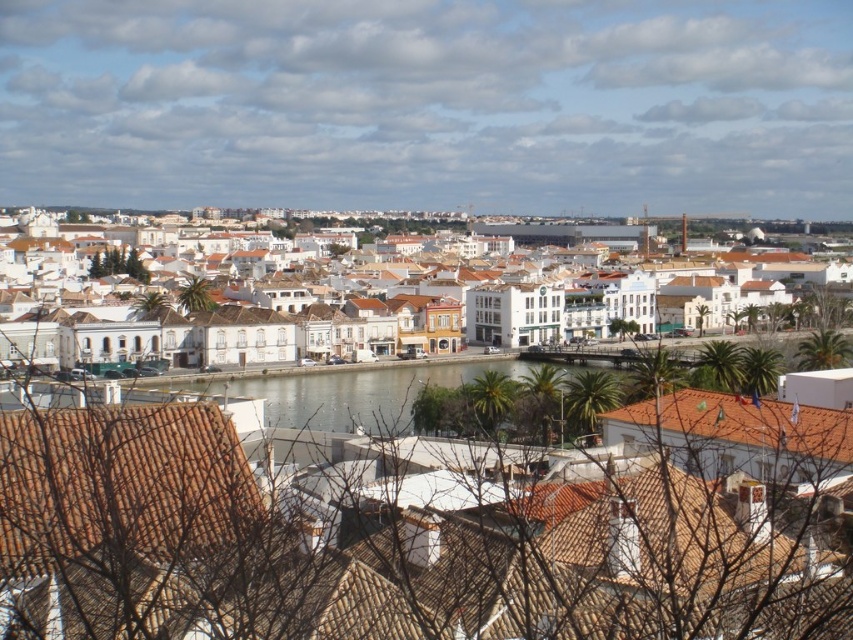
Question: From the image, what is the correct spatial relationship of brown tile roof at lower left in relation to brown tile roof at lower right?

Choices:
 (A) left
 (B) right

Answer: (A)

Question: Considering the real-world distances, which object is closest to the white stucco buildings at center?

Choices:
 (A) brown tile roof at lower right
 (B) brown tile roof at lower left

Answer: (B)

Question: Which of the following is the closest to the observer?

Choices:
 (A) (199, 515)
 (B) (263, 330)
 (C) (720, 440)

Answer: (A)

Question: Which object appears farthest from the camera in this image?

Choices:
 (A) brown tile roof at lower right
 (B) brown tile roof at lower left
 (C) white stucco buildings at center

Answer: (C)

Question: Does white stucco buildings at center come behind brown tile roof at lower right?

Choices:
 (A) no
 (B) yes

Answer: (B)

Question: Is white stucco buildings at center smaller than brown tile roof at lower right?

Choices:
 (A) no
 (B) yes

Answer: (A)